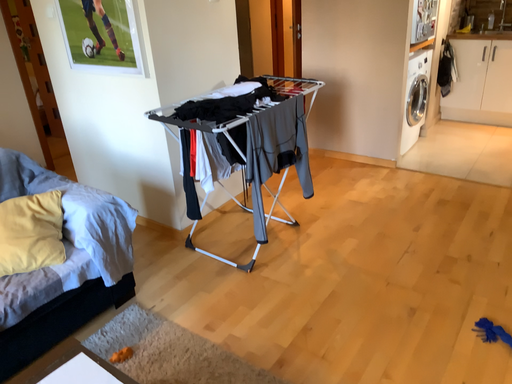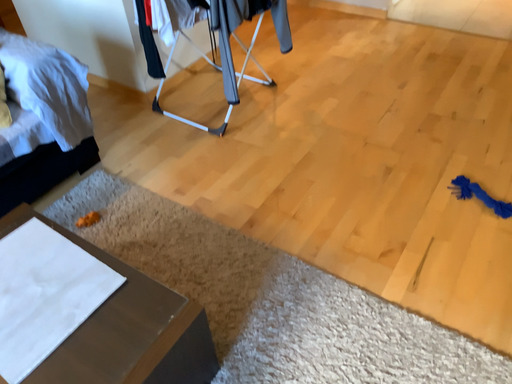
Question: How did the camera likely rotate when shooting the video?

Choices:
 (A) rotated upward
 (B) rotated downward

Answer: (B)